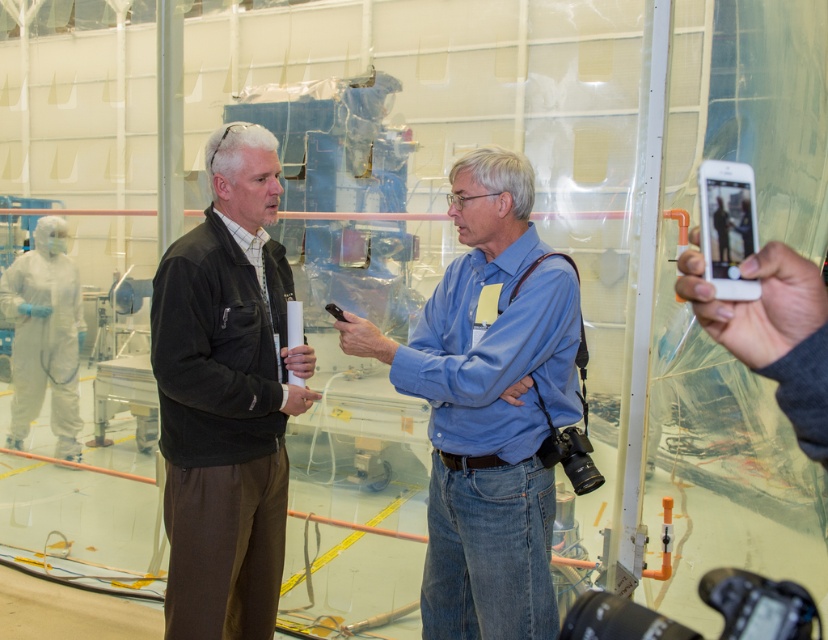
Is blue denim jeans at center to the left of white glossy phone at upper right from the viewer's perspective?

Indeed, blue denim jeans at center is positioned on the left side of white glossy phone at upper right.

Between blue denim jeans at center and white glossy phone at upper right, which one is positioned lower?

blue denim jeans at center is below.

The image size is (828, 640). What do you see at coordinates (489, 406) in the screenshot?
I see `blue denim jeans at center` at bounding box center [489, 406].

Image resolution: width=828 pixels, height=640 pixels. In order to click on blue denim jeans at center in this screenshot , I will do `click(489, 406)`.

Does blue denim jeans at center come behind black plastic pen at center?

No.

What do you see at coordinates (489, 406) in the screenshot?
I see `blue denim jeans at center` at bounding box center [489, 406].

You are a GUI agent. You are given a task and a screenshot of the screen. Output one action in this format:
    pyautogui.click(x=<x>, y=<y>)
    Task: Click on the blue denim jeans at center
    The image size is (828, 640).
    Given the screenshot: What is the action you would take?
    click(x=489, y=406)

Is white glossy phone at upper right shorter than black plastic pen at center?

No, white glossy phone at upper right is not shorter than black plastic pen at center.

Where is `white glossy phone at upper right`? The width and height of the screenshot is (828, 640). white glossy phone at upper right is located at coordinates 727,227.

At what (x,y) coordinates should I click in order to perform the action: click on white glossy phone at upper right. Please return your answer as a coordinate pair (x, y). This screenshot has height=640, width=828. Looking at the image, I should click on (727, 227).